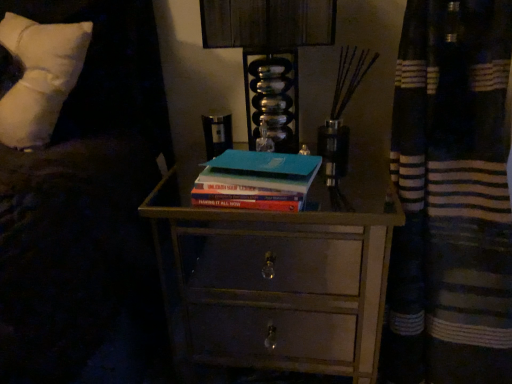
Question: Considering the relative sizes of teal matte book at center and wooden chest of drawers at center in the image provided, is teal matte book at center bigger than wooden chest of drawers at center?

Choices:
 (A) yes
 (B) no

Answer: (B)

Question: Is teal matte book at center not inside wooden chest of drawers at center?

Choices:
 (A) no
 (B) yes

Answer: (B)

Question: Can you confirm if teal matte book at center is positioned to the right of wooden chest of drawers at center?

Choices:
 (A) yes
 (B) no

Answer: (B)

Question: Does teal matte book at center have a smaller size compared to wooden chest of drawers at center?

Choices:
 (A) no
 (B) yes

Answer: (B)

Question: Is teal matte book at center shorter than wooden chest of drawers at center?

Choices:
 (A) yes
 (B) no

Answer: (A)

Question: From the image's perspective, does teal matte book at center appear higher than wooden chest of drawers at center?

Choices:
 (A) no
 (B) yes

Answer: (B)

Question: Does metallic glass at upper center have a smaller size compared to wooden chest of drawers at center?

Choices:
 (A) no
 (B) yes

Answer: (B)

Question: Is the depth of metallic glass at upper center less than that of wooden chest of drawers at center?

Choices:
 (A) no
 (B) yes

Answer: (A)

Question: Is metallic glass at upper center wider than wooden chest of drawers at center?

Choices:
 (A) no
 (B) yes

Answer: (A)

Question: Can you confirm if metallic glass at upper center is taller than wooden chest of drawers at center?

Choices:
 (A) yes
 (B) no

Answer: (B)

Question: Is metallic glass at upper center located outside wooden chest of drawers at center?

Choices:
 (A) yes
 (B) no

Answer: (A)

Question: Is metallic glass at upper center to the left of wooden chest of drawers at center from the viewer's perspective?

Choices:
 (A) no
 (B) yes

Answer: (B)

Question: Does white soft pillow at upper left appear on the left side of wooden chest of drawers at center?

Choices:
 (A) yes
 (B) no

Answer: (A)